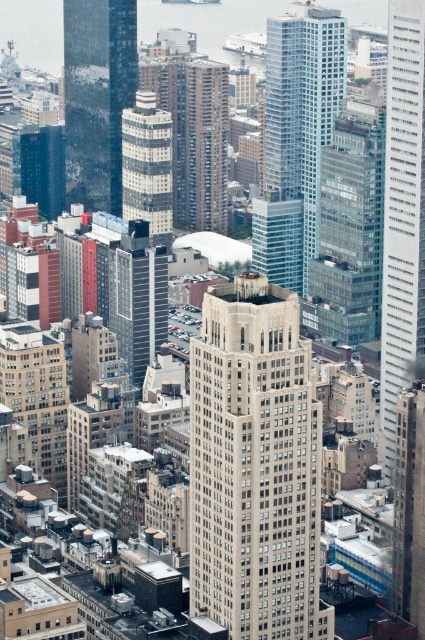
You are standing at a viewpoint overlooking the city. There is a specific point marked at coordinates point (396, 232). If you want to place a 2000 feet long banner from your current position to that point, will the banner be long enough to reach the point?

The distance of point (396, 232) from viewer is 2157.31 feet. Since the banner is only 2000 feet long, it will not be long enough to reach the point.